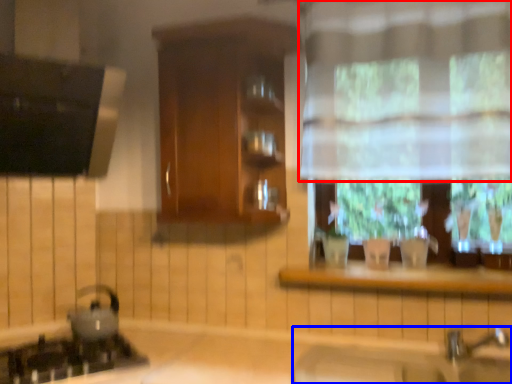
Question: Which point is closer to the camera, curtain (highlighted by a red box) or sink (highlighted by a blue box)?

Choices:
 (A) curtain
 (B) sink

Answer: (B)